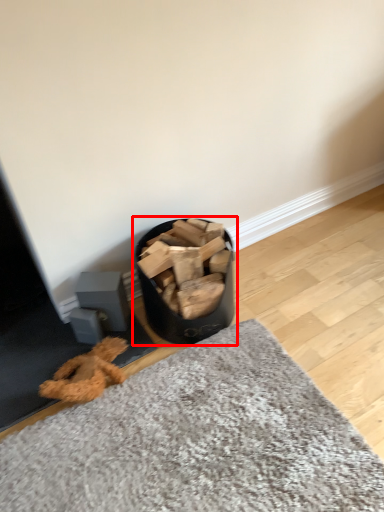
Question: From the image's perspective, considering the relative positions of waste container (annotated by the red box) and mat in the image provided, where is waste container (annotated by the red box) located with respect to the staircase?

Choices:
 (A) below
 (B) above

Answer: (B)